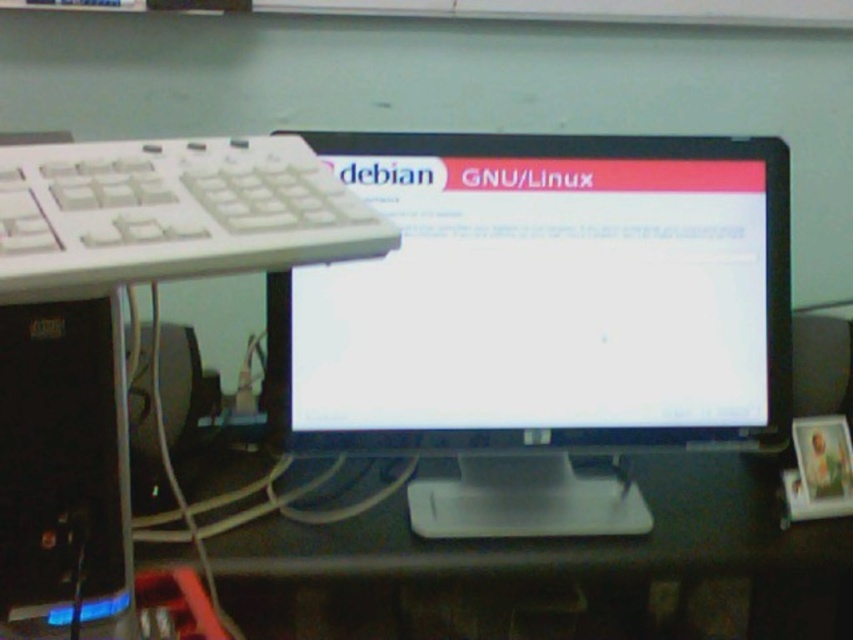
You are a delivery person who needs to place a package on the desk without blocking the computer monitor. The package is 16 inches wide. Considering the white plastic keyboard at left is 18.38 inches from the camera, can you safely place the package on the desk near the keyboard without overlapping the monitor?

The white plastic keyboard at left is 18.38 inches from the camera. Since the package is 16 inches wide, placing it near the keyboard would leave enough space between the keyboard and the monitor, so it should not overlap. However, ensure there is sufficient clearance from the monitor itself based on the desk layout.

You are setting up a new computer desk and want to place the white plastic keyboard at left and the black plastic desktop computer at left on your desk. If your desk has a total width of 24 inches, will both items fit side by side without overlapping?

The white plastic keyboard at left is 6.75 inches away from the black plastic desktop computer at left, which indicates the combined width of both items is 6.75 inches. Since the desk is 24 inches wide, there is ample space for both items to fit side by side without overlapping.

Consider the image. You are setting up a new workspace and need to place a mouse between the white plastic keyboard at left and the black plastic desktop computer at left. Based on their positions, where should you place the mouse relative to the keyboard and computer?

Since the white plastic keyboard at left is located above the black plastic desktop computer at left, you should place the mouse between them such that it is below the keyboard and above the computer.